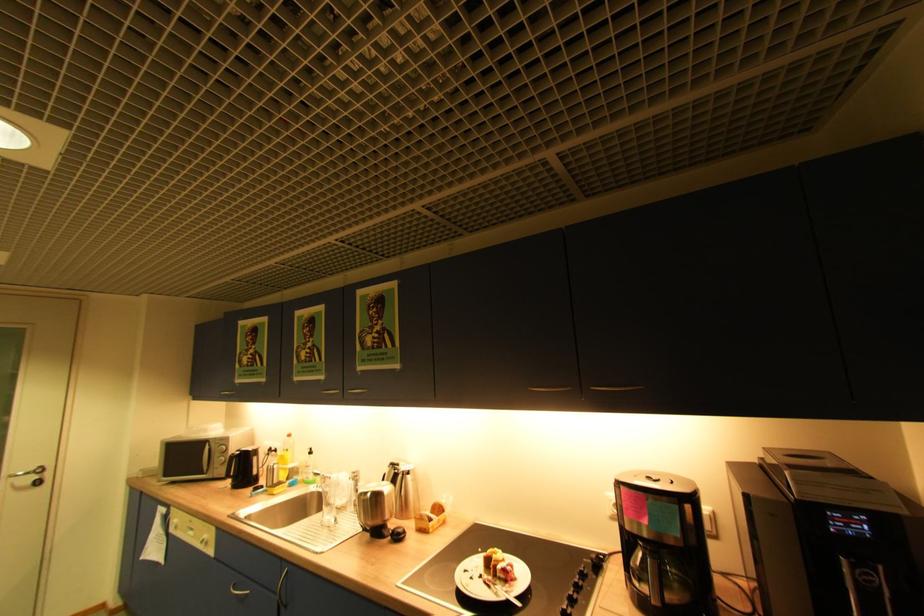
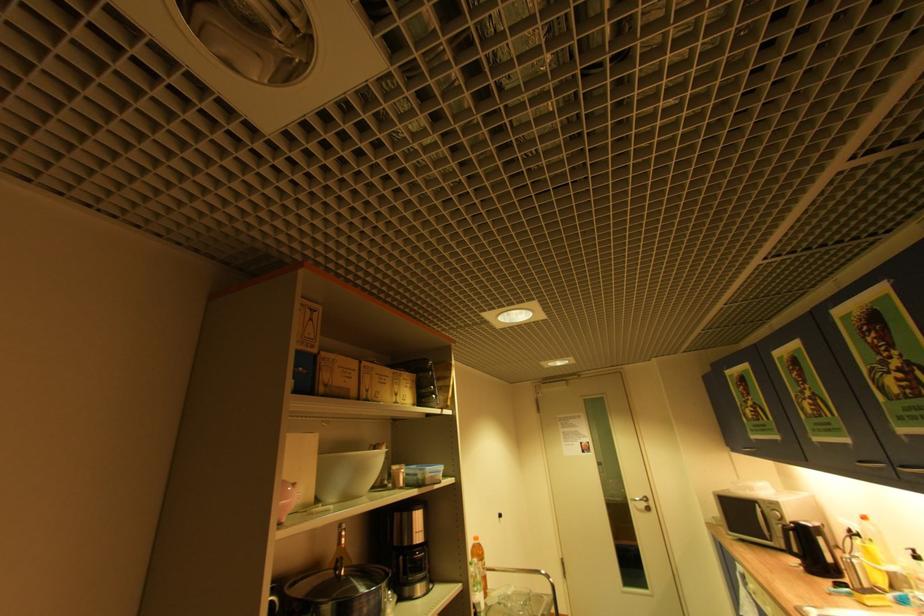
Where in the second image is the point corresponding to the point at 41,477 from the first image?

(650, 505)